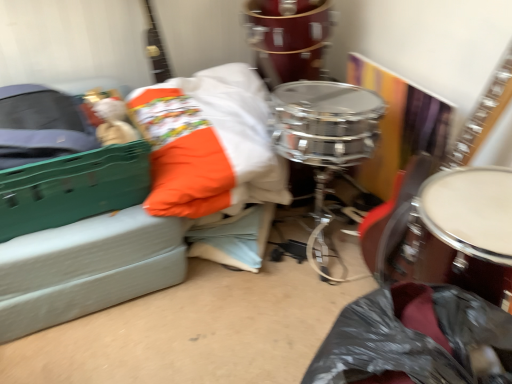
Question: Considering the relative sizes of shiny chrome drum at center, which is the first drum in top-to-bottom order, and wooden acoustic guitar at center right, the 2th guitar positioned from the left, in the image provided, is shiny chrome drum at center, which is the first drum in top-to-bottom order, taller than wooden acoustic guitar at center right, the 2th guitar positioned from the left,?

Choices:
 (A) no
 (B) yes

Answer: (A)

Question: Considering the relative sizes of shiny chrome drum at center, which is the second drum in bottom-to-top order, and wooden acoustic guitar at center right, which is counted as the 1th guitar, starting from the right, in the image provided, is shiny chrome drum at center, which is the second drum in bottom-to-top order, bigger than wooden acoustic guitar at center right, which is counted as the 1th guitar, starting from the right,?

Choices:
 (A) no
 (B) yes

Answer: (B)

Question: Does shiny chrome drum at center, the 1th drum viewed from the back, have a greater width compared to wooden acoustic guitar at center right, which is counted as the 1th guitar, starting from the right?

Choices:
 (A) yes
 (B) no

Answer: (A)

Question: Is shiny chrome drum at center, which is the second drum in bottom-to-top order, in front of wooden acoustic guitar at center right, the 2th guitar positioned from the left?

Choices:
 (A) no
 (B) yes

Answer: (A)

Question: From the image's perspective, does shiny chrome drum at center, which is the second drum in bottom-to-top order, appear higher than wooden acoustic guitar at center right, the 2th guitar positioned from the left?

Choices:
 (A) yes
 (B) no

Answer: (A)

Question: Is point (166, 64) closer or farther from the camera than point (420, 281)?

Choices:
 (A) closer
 (B) farther

Answer: (B)

Question: Is glossy wood guitar at upper left, the 2th guitar when ordered from right to left, taller or shorter than shiny brown drum at right, acting as the 2th drum starting from the top?

Choices:
 (A) short
 (B) tall

Answer: (A)

Question: From a real-world perspective, is glossy wood guitar at upper left, acting as the 1th guitar starting from the left, above or below shiny brown drum at right, acting as the 2th drum starting from the top?

Choices:
 (A) below
 (B) above

Answer: (B)

Question: Is glossy wood guitar at upper left, acting as the 1th guitar starting from the left, to the left or to the right of shiny brown drum at right, the 2th drum viewed from the back, in the image?

Choices:
 (A) right
 (B) left

Answer: (B)

Question: Considering the positions of point (503, 231) and point (275, 59), is point (503, 231) closer or farther from the camera than point (275, 59)?

Choices:
 (A) farther
 (B) closer

Answer: (B)

Question: In terms of width, does shiny brown drum at right, the 1th drum from the bottom, look wider or thinner when compared to shiny chrome drum at center, which is the second drum in bottom-to-top order?

Choices:
 (A) thin
 (B) wide

Answer: (A)

Question: In terms of height, does shiny brown drum at right, acting as the 2th drum starting from the top, look taller or shorter compared to shiny chrome drum at center, the 1th drum viewed from the back?

Choices:
 (A) short
 (B) tall

Answer: (B)

Question: From a real-world perspective, is shiny brown drum at right, placed as the 1th drum when sorted from front to back, positioned above or below shiny chrome drum at center, which is the first drum in top-to-bottom order?

Choices:
 (A) above
 (B) below

Answer: (B)

Question: From the image's perspective, relative to glossy wood guitar at upper left, the 2th guitar when ordered from right to left, is shiny chrome drum at center, the 1th drum viewed from the back, above or below?

Choices:
 (A) above
 (B) below

Answer: (A)

Question: Based on their sizes in the image, would you say shiny chrome drum at center, which is the first drum in top-to-bottom order, is bigger or smaller than glossy wood guitar at upper left, acting as the 1th guitar starting from the left?

Choices:
 (A) small
 (B) big

Answer: (B)